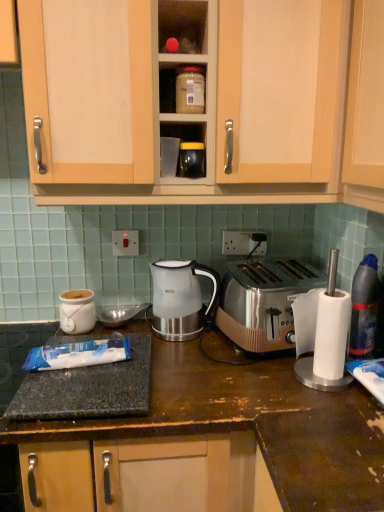
Question: Is white plastic socket at center, which is the first electric outlet from right to left, smaller than matte plastic container at upper center?

Choices:
 (A) yes
 (B) no

Answer: (A)

Question: From a real-world perspective, does white plastic socket at center, the first electric outlet from the back, stand above matte plastic container at upper center?

Choices:
 (A) yes
 (B) no

Answer: (B)

Question: From a real-world perspective, is white plastic socket at center, the first electric outlet from the back, physically below matte plastic container at upper center?

Choices:
 (A) no
 (B) yes

Answer: (B)

Question: Does white plastic socket at center, which is the second electric outlet from left to right, have a lesser height compared to matte plastic container at upper center?

Choices:
 (A) no
 (B) yes

Answer: (B)

Question: Is white plastic socket at center, the first electric outlet from the back, to the left of matte plastic container at upper center from the viewer's perspective?

Choices:
 (A) no
 (B) yes

Answer: (A)

Question: Is matte plastic container at upper center located within white plastic socket at center, the first electric outlet from the back?

Choices:
 (A) yes
 (B) no

Answer: (B)

Question: Does matte plastic container at upper center appear on the right side of matte white ceramic jar at left, arranged as the 1th appliance when ordered from the bottom?

Choices:
 (A) yes
 (B) no

Answer: (A)

Question: Does matte plastic container at upper center appear on the left side of matte white ceramic jar at left, which is counted as the first appliance, starting from the back?

Choices:
 (A) no
 (B) yes

Answer: (A)

Question: Is matte plastic container at upper center closer to the viewer compared to matte white ceramic jar at left, which ranks as the 2th appliance in top-to-bottom order?

Choices:
 (A) no
 (B) yes

Answer: (B)

Question: Is matte plastic container at upper center turned away from matte white ceramic jar at left, which ranks as the 2th appliance in top-to-bottom order?

Choices:
 (A) yes
 (B) no

Answer: (B)

Question: Considering the relative sizes of matte plastic container at upper center and matte white ceramic jar at left, which ranks as the 2th appliance in top-to-bottom order, in the image provided, is matte plastic container at upper center smaller than matte white ceramic jar at left, which ranks as the 2th appliance in top-to-bottom order,?

Choices:
 (A) yes
 (B) no

Answer: (A)

Question: Is matte plastic container at upper center shorter than matte white ceramic jar at left, which ranks as the 2th appliance in top-to-bottom order?

Choices:
 (A) yes
 (B) no

Answer: (A)

Question: Is granite dark brown at lower left looking in the opposite direction of matte plastic container at upper center?

Choices:
 (A) yes
 (B) no

Answer: (B)